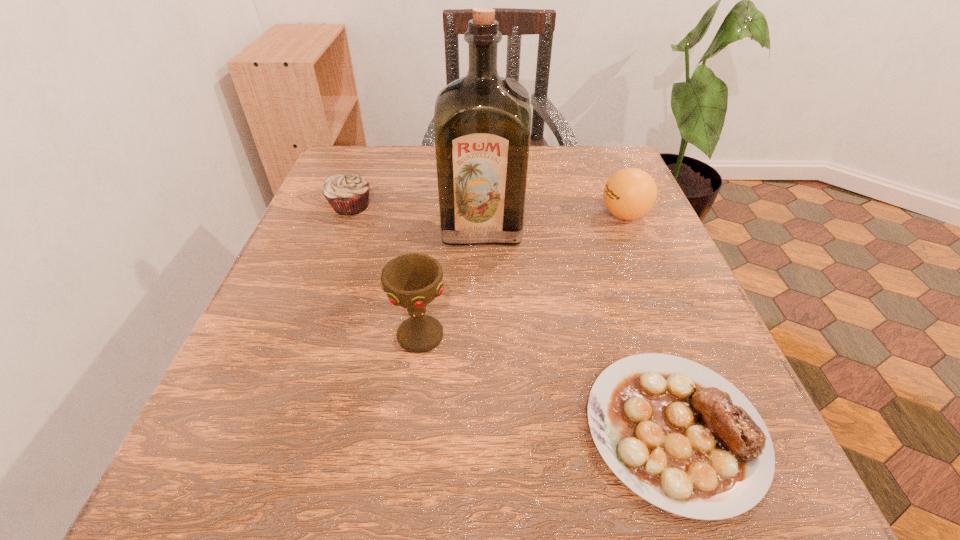
Image resolution: width=960 pixels, height=540 pixels. In order to click on vacant region at the far edge of the desktop in this screenshot , I will do `click(433, 153)`.

Find the location of a particular element. free space at the near edge of the desktop is located at coordinates (360, 513).

Locate an element on the screen. free space at the left edge of the desktop is located at coordinates (298, 408).

You are a GUI agent. You are given a task and a screenshot of the screen. Output one action in this format:
    pyautogui.click(x=<x>, y=<y>)
    Task: Click on the blank space at the right edge of the desktop
    This screenshot has height=540, width=960.
    Given the screenshot: What is the action you would take?
    pyautogui.click(x=674, y=258)

Image resolution: width=960 pixels, height=540 pixels. Find the location of `unoccupied area between the steak and the tallest object`. unoccupied area between the steak and the tallest object is located at coordinates (578, 328).

The image size is (960, 540). What are the coordinates of `vacant space that is in between the second tallest object and the third tallest object` in the screenshot? It's located at (522, 275).

Where is `unoccupied area between the steak and the liquor`? Image resolution: width=960 pixels, height=540 pixels. unoccupied area between the steak and the liquor is located at coordinates (578, 328).

The height and width of the screenshot is (540, 960). Identify the location of free space between the shortest object and the liquor. (578, 328).

Where is `unoccupied area between the ping-pong ball and the tallest object`? The image size is (960, 540). unoccupied area between the ping-pong ball and the tallest object is located at coordinates (553, 221).

Identify the location of vacant area that lies between the liquor and the chalice. This screenshot has width=960, height=540. click(x=451, y=281).